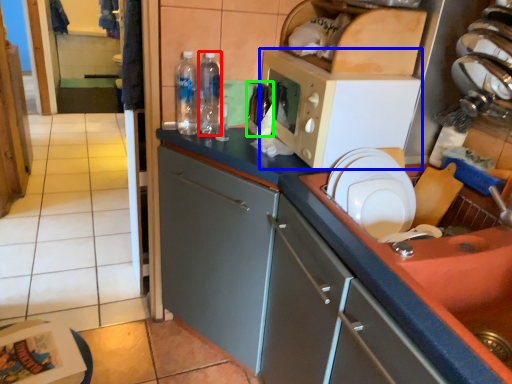
Question: Considering the real-world distances, which object is closest to bottle (highlighted by a red box)? microwave oven (highlighted by a blue box) or bottle (highlighted by a green box).

Choices:
 (A) microwave oven
 (B) bottle

Answer: (B)